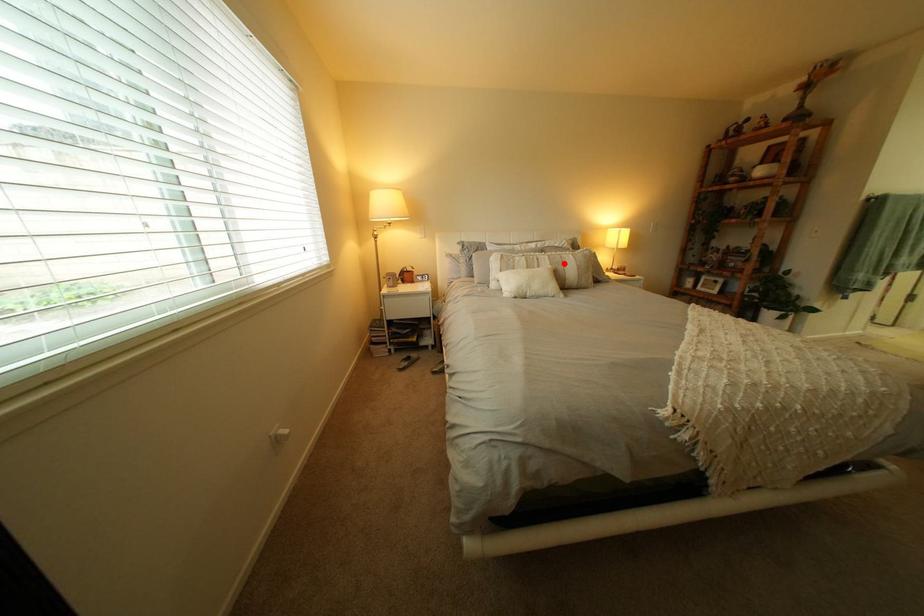
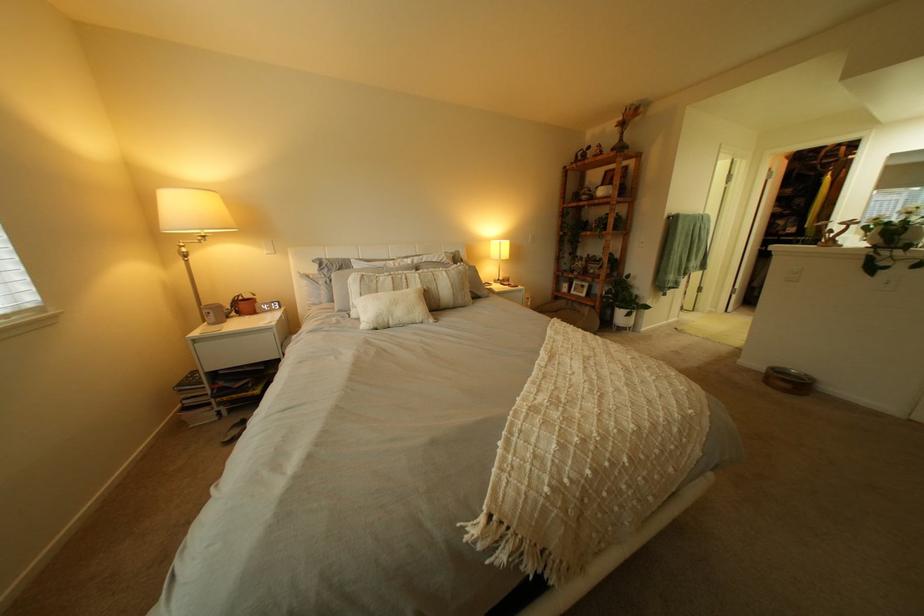
Locate, in the second image, the point that corresponds to the highlighted location in the first image.

(434, 283)